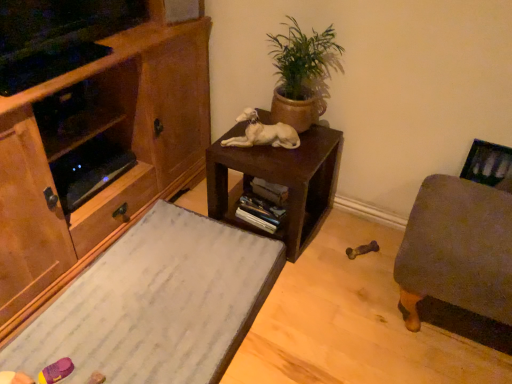
Question: Is white marble desk at lower left not within brown matte table at center?

Choices:
 (A) yes
 (B) no

Answer: (A)

Question: Is white marble desk at lower left touching brown matte table at center?

Choices:
 (A) yes
 (B) no

Answer: (B)

Question: Does white marble desk at lower left come in front of brown matte table at center?

Choices:
 (A) yes
 (B) no

Answer: (A)

Question: From the image's perspective, is white marble desk at lower left under brown matte table at center?

Choices:
 (A) yes
 (B) no

Answer: (A)

Question: Could you tell me if white marble desk at lower left is turned towards brown matte table at center?

Choices:
 (A) yes
 (B) no

Answer: (B)

Question: Is green matte pot at upper center to the left or to the right of wooden cabinet at left in the image?

Choices:
 (A) left
 (B) right

Answer: (B)

Question: Considering their positions, is green matte pot at upper center located in front of or behind wooden cabinet at left?

Choices:
 (A) front
 (B) behind

Answer: (B)

Question: Is point (309, 119) positioned closer to the camera than point (140, 117)?

Choices:
 (A) farther
 (B) closer

Answer: (A)

Question: From the image's perspective, is green matte pot at upper center above or below wooden cabinet at left?

Choices:
 (A) below
 (B) above

Answer: (B)

Question: Considering their positions, is green matte pot at upper center located in front of or behind white marble desk at lower left?

Choices:
 (A) front
 (B) behind

Answer: (B)

Question: From the image's perspective, relative to white marble desk at lower left, is green matte pot at upper center above or below?

Choices:
 (A) below
 (B) above

Answer: (B)

Question: In the image, is green matte pot at upper center on the left side or the right side of white marble desk at lower left?

Choices:
 (A) left
 (B) right

Answer: (B)

Question: Considering the positions of green matte pot at upper center and white marble desk at lower left in the image, is green matte pot at upper center taller or shorter than white marble desk at lower left?

Choices:
 (A) short
 (B) tall

Answer: (B)

Question: Is wooden cabinet at left taller or shorter than green matte pot at upper center?

Choices:
 (A) tall
 (B) short

Answer: (A)

Question: Looking at their shapes, would you say wooden cabinet at left is wider or thinner than green matte pot at upper center?

Choices:
 (A) thin
 (B) wide

Answer: (B)